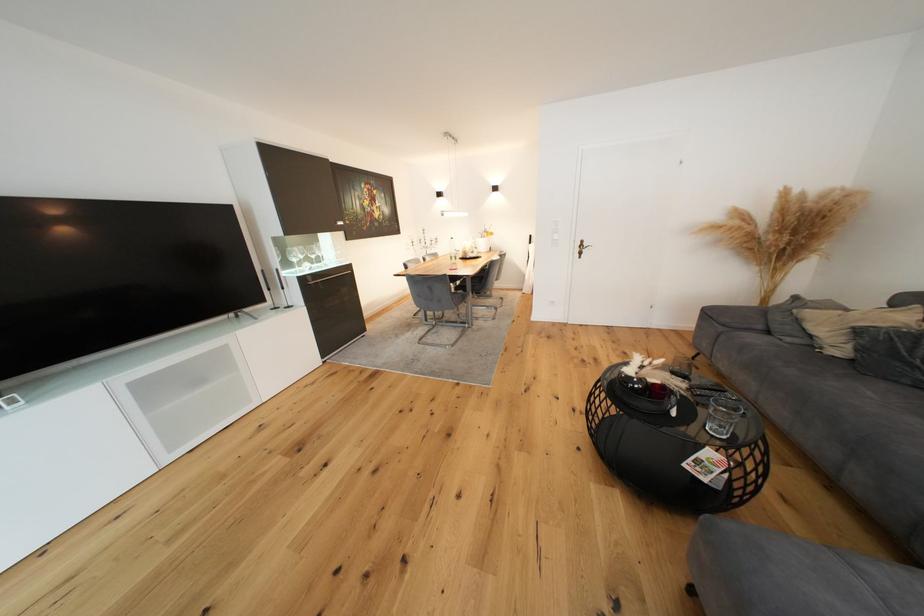
The image size is (924, 616). What do you see at coordinates (633, 383) in the screenshot? I see `a small black bowl` at bounding box center [633, 383].